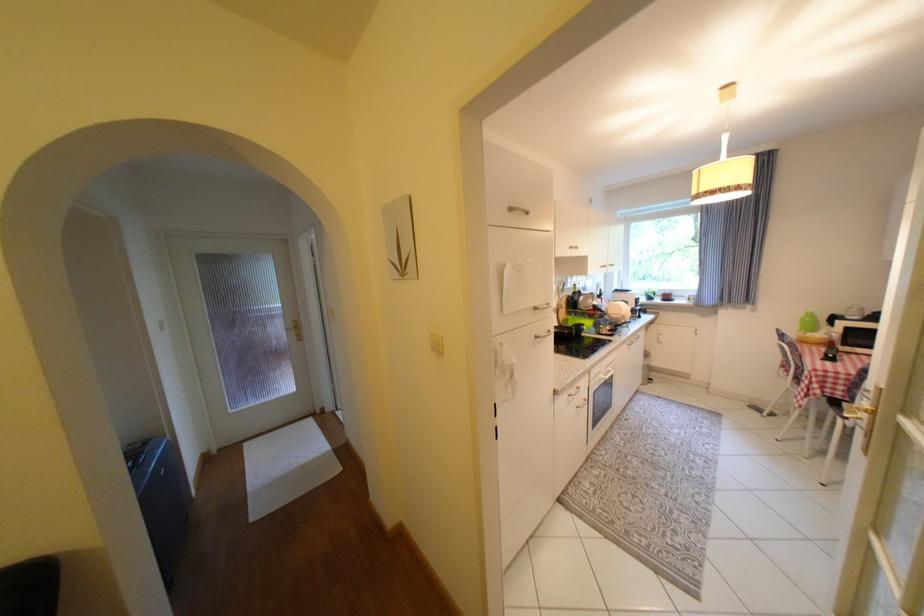
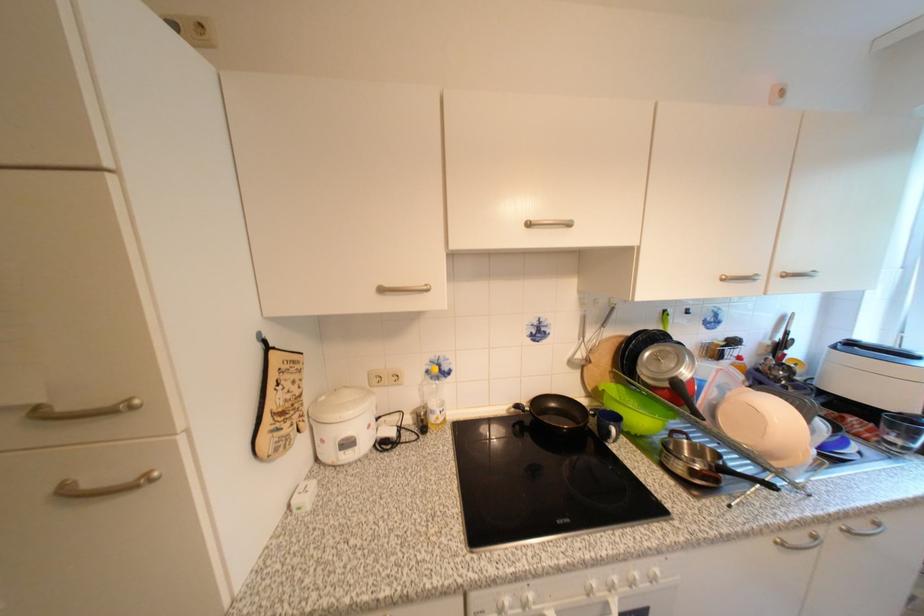
Where in the second image is the point corresponding to point (598, 323) from the first image?

(651, 421)